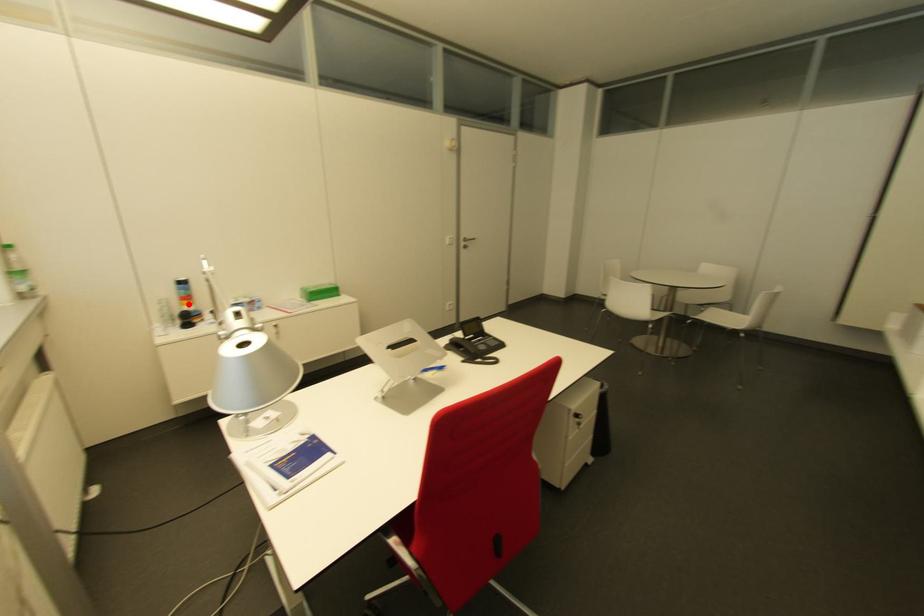
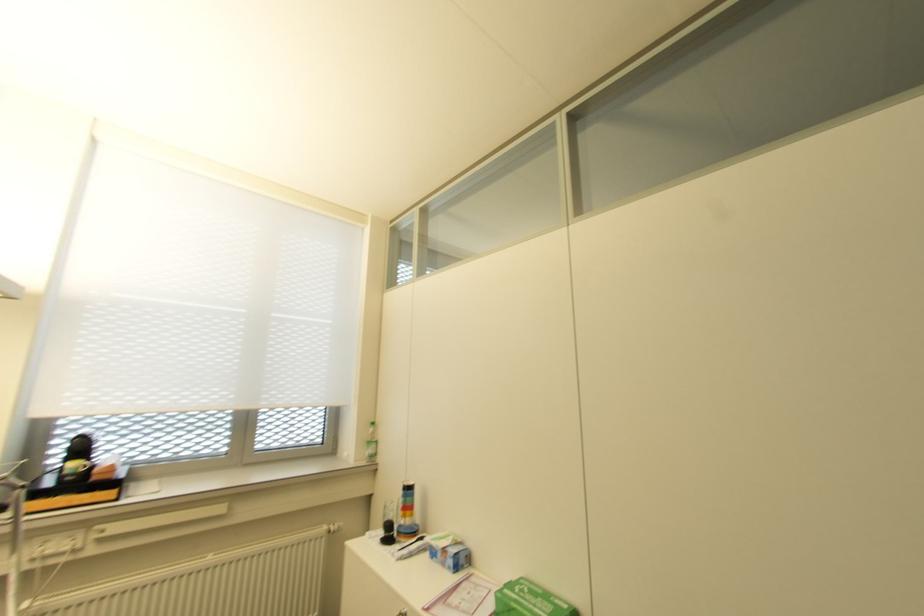
Question: I am providing you with two images of the same scene from different viewpoints. A red point is shown in image1. For the corresponding object point in image2, is it positioned nearer or farther from the camera?

Choices:
 (A) Nearer
 (B) Farther

Answer: (B)